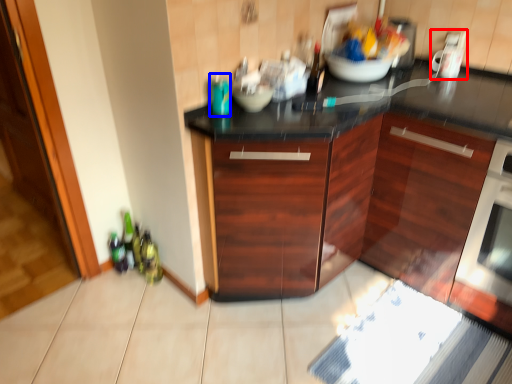
Question: Which of the following is the farthest to the observer, appliance (highlighted by a red box) or bottle (highlighted by a blue box)?

Choices:
 (A) appliance
 (B) bottle

Answer: (A)